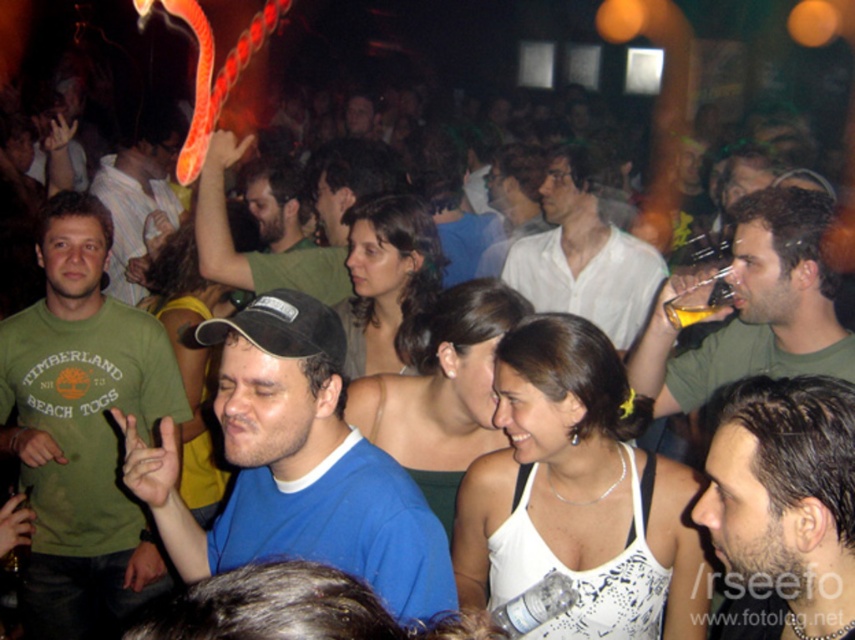
Does green matte shirt at center have a smaller size compared to green cotton t-shirt at center?

Correct, green matte shirt at center occupies less space than green cotton t-shirt at center.

In order to click on green matte shirt at center in this screenshot , I will do `click(752, 308)`.

What do you see at coordinates (752, 308) in the screenshot?
I see `green matte shirt at center` at bounding box center [752, 308].

I want to click on green matte shirt at center, so click(752, 308).

Image resolution: width=855 pixels, height=640 pixels. What do you see at coordinates (295, 467) in the screenshot? I see `blue cotton t-shirt at center` at bounding box center [295, 467].

Is blue cotton t-shirt at center shorter than green matte shirt at center?

No, blue cotton t-shirt at center is not shorter than green matte shirt at center.

Is point (164, 484) positioned behind point (771, 259)?

That is False.

The height and width of the screenshot is (640, 855). Identify the location of blue cotton t-shirt at center. (295, 467).

Which is in front, point (57, 339) or point (161, 182)?

Point (57, 339) is more forward.

Measure the distance between point (22,608) and camera.

A distance of 2.82 meters exists between point (22,608) and camera.

Find the location of a particular element. green cotton t-shirt at left is located at coordinates (81, 428).